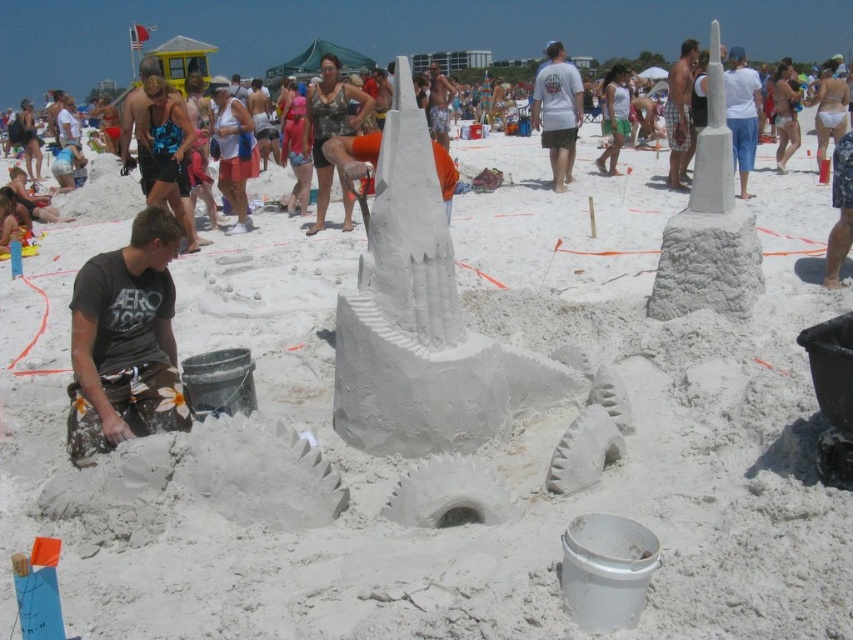
You are a photographer standing at the camera position. You want to take a photo that includes both the point at coordinates point (573, 116) and point (444, 96). Which point will appear larger in the photo?

Point (573, 116) is closer to the camera than point (444, 96), so it will appear larger in the photo.

You are a photographer trying to capture the sandcastle competition. You notice two points marked in the image. Which point, point [552,150] or point [666,180], is closer to your camera lens?

Point [552,150] is further to the camera than point [666,180], so the point closer to the camera lens is point [666,180].